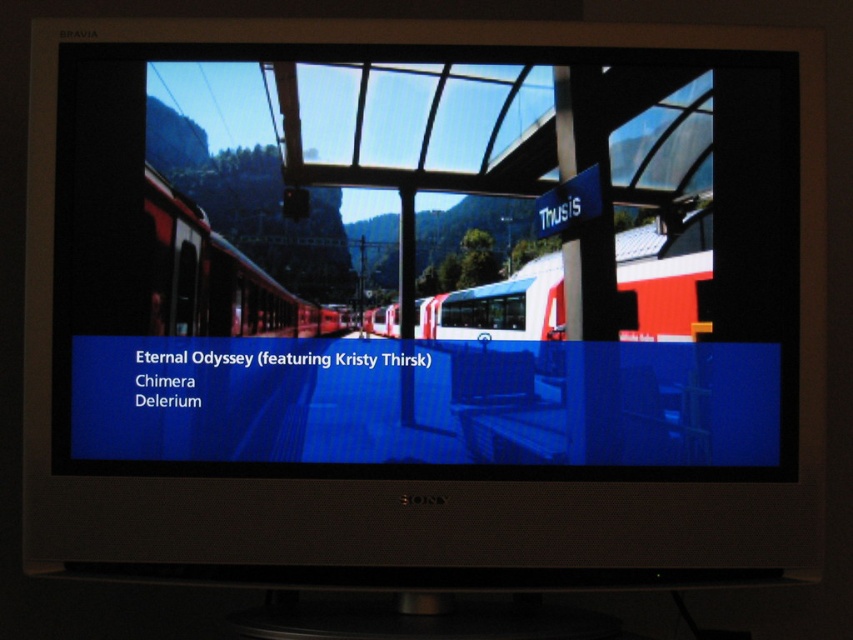
Question: Is matte black screen at center closer to the viewer compared to matte red train at left?

Choices:
 (A) no
 (B) yes

Answer: (B)

Question: Is red matte train at center further to camera compared to white glossy train at center?

Choices:
 (A) no
 (B) yes

Answer: (A)

Question: Which object is farther from the camera taking this photo?

Choices:
 (A) matte red train at left
 (B) white glossy train at center

Answer: (B)

Question: Which point is farther to the camera?

Choices:
 (A) white glossy train at center
 (B) matte black screen at center

Answer: (A)

Question: Which of the following is the closest to the observer?

Choices:
 (A) matte black screen at center
 (B) white glossy train at center
 (C) red matte train at center

Answer: (A)

Question: Can you confirm if white glossy train at center is positioned above matte red train at left?

Choices:
 (A) no
 (B) yes

Answer: (A)